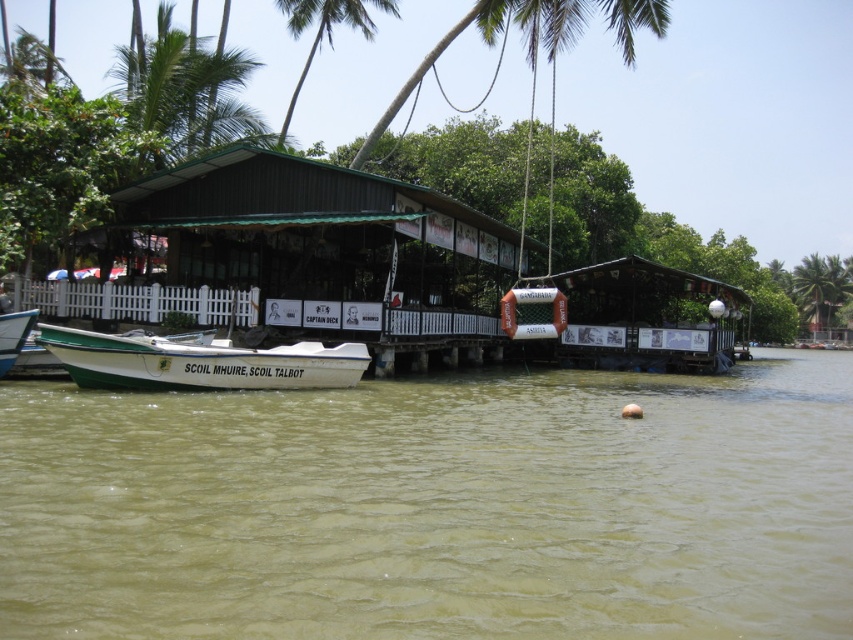
You are a tourist standing at the riverside and want to take a photo of the green leafy palm tree at upper left and the green murky water at lower center. If your camera can capture objects within a 20 meter range, will both be in the same photo?

The distance between the green murky water at lower center and the green leafy palm tree at upper left is 17.54 meters, which is within the camera range of 20 meters. Therefore, both objects will be in the same photo.

You are standing at the riverside and see the small white boat with green trim docked near the wooden structure. There is a point marked at coordinates (816,289). What object is located at that point?

The point at coordinates (816,289) has a green leafy palm tree at upper right.